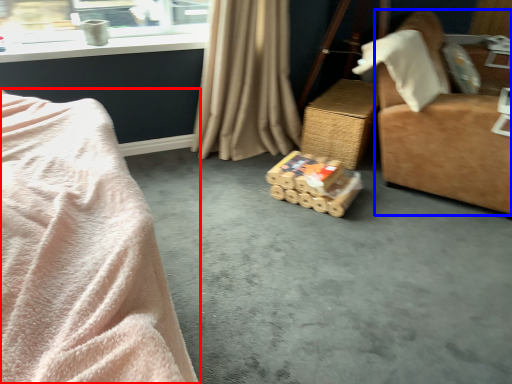
Question: Which object is closer to the camera taking this photo, bed (highlighted by a red box) or furniture (highlighted by a blue box)?

Choices:
 (A) bed
 (B) furniture

Answer: (A)